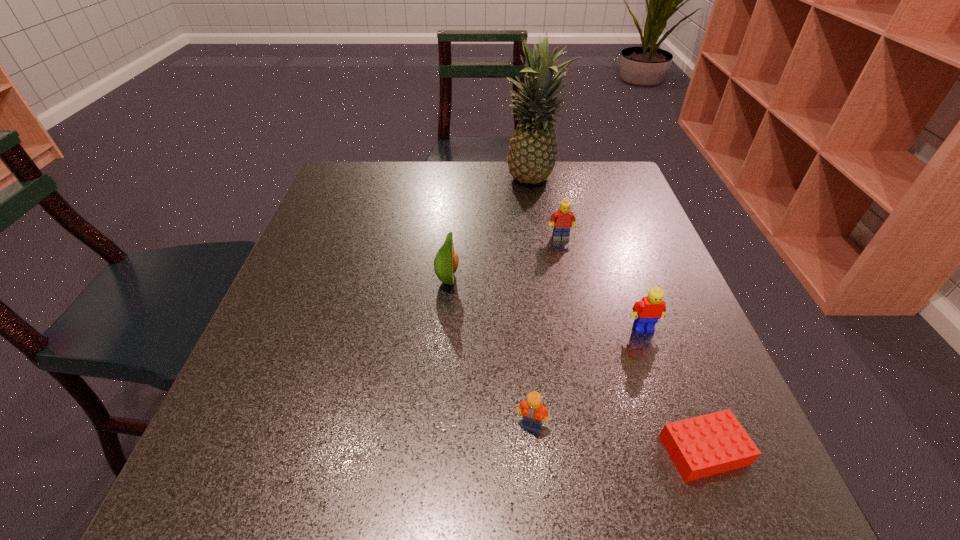
At what (x,y) coordinates should I click in order to perform the action: click on vacant space located on the front of the farthest object. Please return your answer as a coordinate pair (x, y). The width and height of the screenshot is (960, 540). Looking at the image, I should click on (550, 293).

The height and width of the screenshot is (540, 960). I want to click on vacant region located 0.360m on the cut side of the leftmost object, so click(628, 281).

Find the location of a particular element. This screenshot has width=960, height=540. vacant space situated 0.050m on the front-facing side of the farthest Lego is located at coordinates (564, 255).

Where is `free space located on the front-facing side of the fourth farthest object`? The image size is (960, 540). free space located on the front-facing side of the fourth farthest object is located at coordinates (701, 492).

Where is `vacant position located 0.250m on the back of the shortest object`? Image resolution: width=960 pixels, height=540 pixels. vacant position located 0.250m on the back of the shortest object is located at coordinates (649, 307).

You are a GUI agent. You are given a task and a screenshot of the screen. Output one action in this format:
    pyautogui.click(x=<x>, y=<y>)
    Task: Click on the object that is at the far edge
    The image size is (960, 540).
    Given the screenshot: What is the action you would take?
    pyautogui.click(x=533, y=151)

Locate an element on the screen. object located in the near edge section of the desktop is located at coordinates (714, 443).

You are a GUI agent. You are given a task and a screenshot of the screen. Output one action in this format:
    pyautogui.click(x=<x>, y=<y>)
    Task: Click on the object positioned at the near right corner
    
    Given the screenshot: What is the action you would take?
    pyautogui.click(x=714, y=443)

Where is `free region at the far edge`? The image size is (960, 540). free region at the far edge is located at coordinates (573, 201).

Locate an element on the screen. vacant space at the near edge is located at coordinates (539, 485).